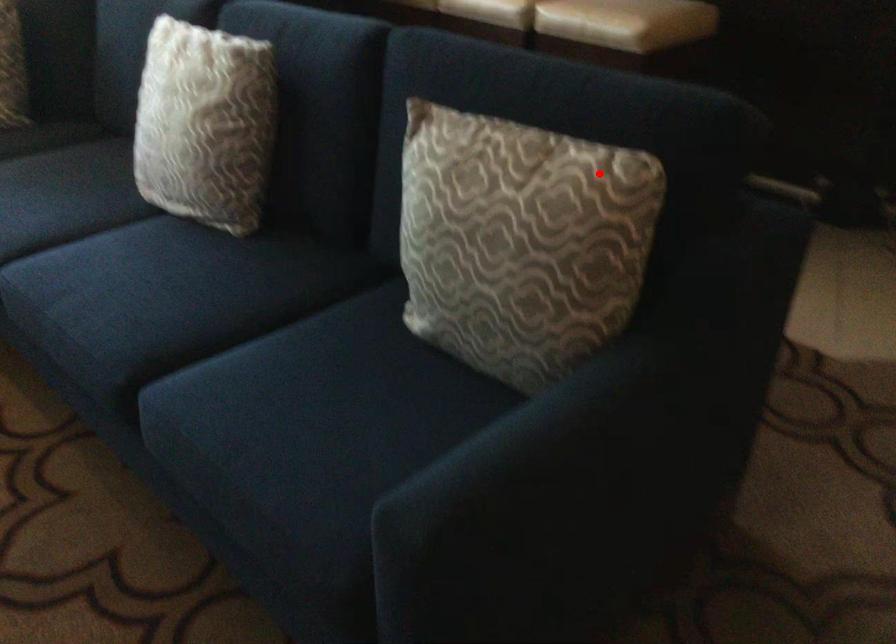
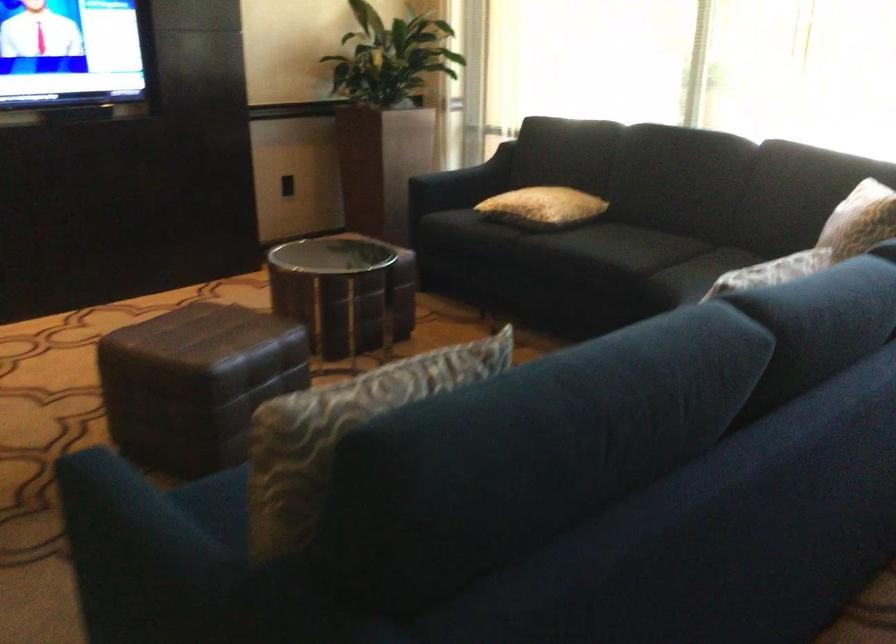
Question: I am providing you with two images of the same scene from different viewpoints. Image1 has a red point marked. In image2, the corresponding 3D location appears at what relative position? Reply with the corresponding letter.

Choices:
 (A) Closer
 (B) Farther

Answer: (A)